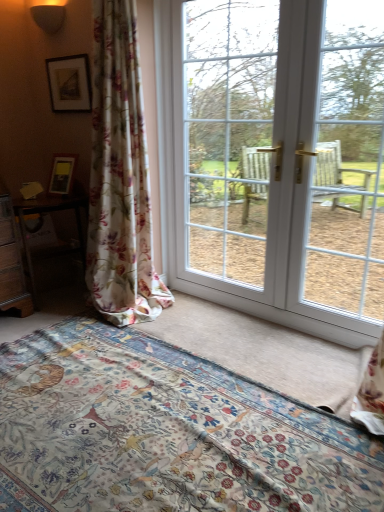
You are a GUI agent. You are given a task and a screenshot of the screen. Output one action in this format:
    pyautogui.click(x=<x>, y=<y>)
    Task: Click on the vacant area that lies in front of floral fabric curtain at left
    Image resolution: width=384 pixels, height=512 pixels.
    Given the screenshot: What is the action you would take?
    pyautogui.click(x=108, y=344)